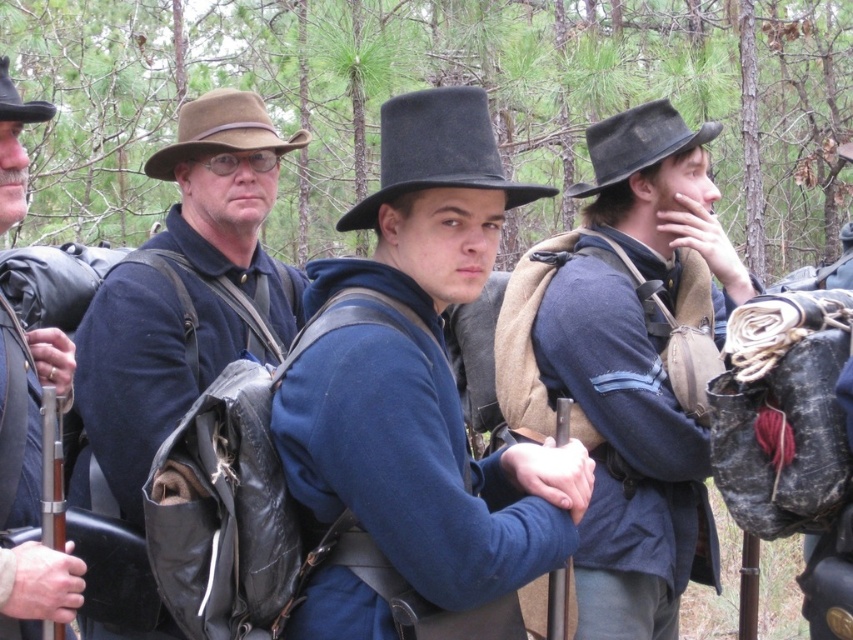
You are a historian examining a painting of Civil War soldiers. You notice two hats in the image. The first is a black felt hat at center, and the second is a brown felt cowboy hat at upper left. Based on historical accuracy, which hat is more likely to belong to a Union soldier, and why?

The black felt hat at center is more likely to belong to a Union soldier because Union soldiers typically wore hats with higher crowns, and the description states that the black felt hat at center is taller than the brown felt cowboy hat at upper left, aligning with historical attire standards.